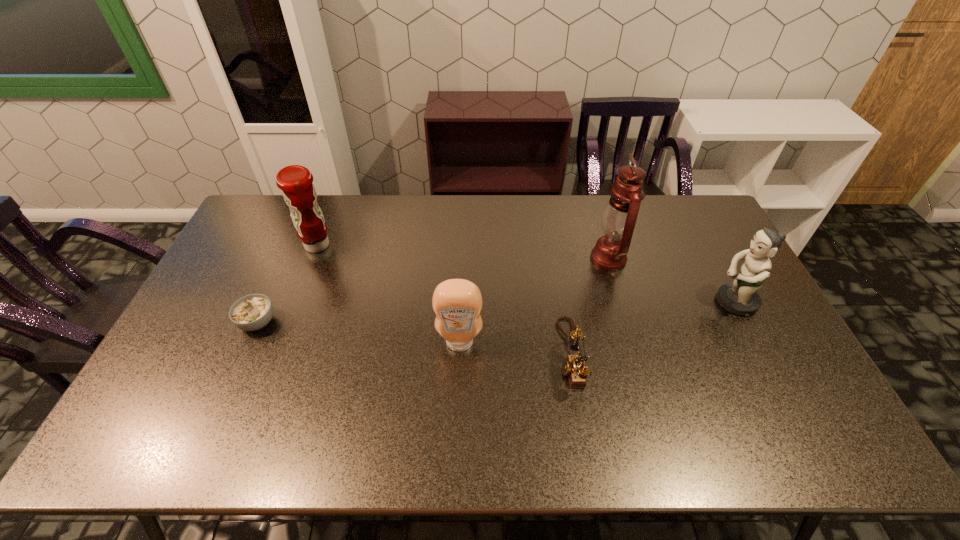
This screenshot has width=960, height=540. I want to click on blank region between the tallest object and the figurine, so click(x=671, y=280).

Where is `vacant region between the rightmost object and the third object from left to right`? vacant region between the rightmost object and the third object from left to right is located at coordinates (596, 322).

The height and width of the screenshot is (540, 960). Find the location of `vacant space in between the taller condiment and the oil lamp`. vacant space in between the taller condiment and the oil lamp is located at coordinates (463, 252).

Where is `vacant area between the taller condiment and the shortest object`? This screenshot has height=540, width=960. vacant area between the taller condiment and the shortest object is located at coordinates (288, 284).

Find the location of `vacant space in between the soup bowl and the left condiment`. vacant space in between the soup bowl and the left condiment is located at coordinates (288, 284).

I want to click on vacant space that is in between the shortest object and the tallest object, so click(433, 290).

Locate an element on the screen. The height and width of the screenshot is (540, 960). the third closest object to the fourth object from left to right is located at coordinates (740, 297).

Choose which object is the fifth nearest neighbor to the telephone. Please provide its 2D coordinates. Your answer should be formatted as a tuple, i.e. [(x, y)], where the tuple contains the x and y coordinates of a point satisfying the conditions above.

[(252, 312)]